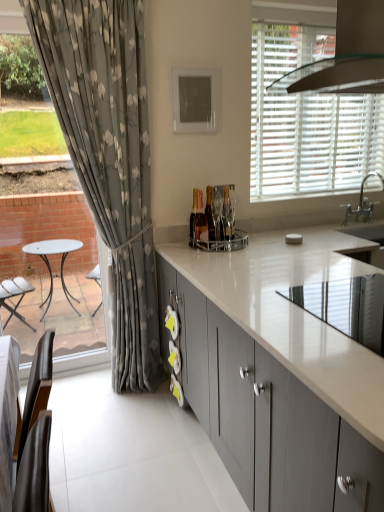
Locate an element on the screen. vacant space underneath fluffy gray curtain at left (from a real-world perspective) is located at coordinates (115, 394).